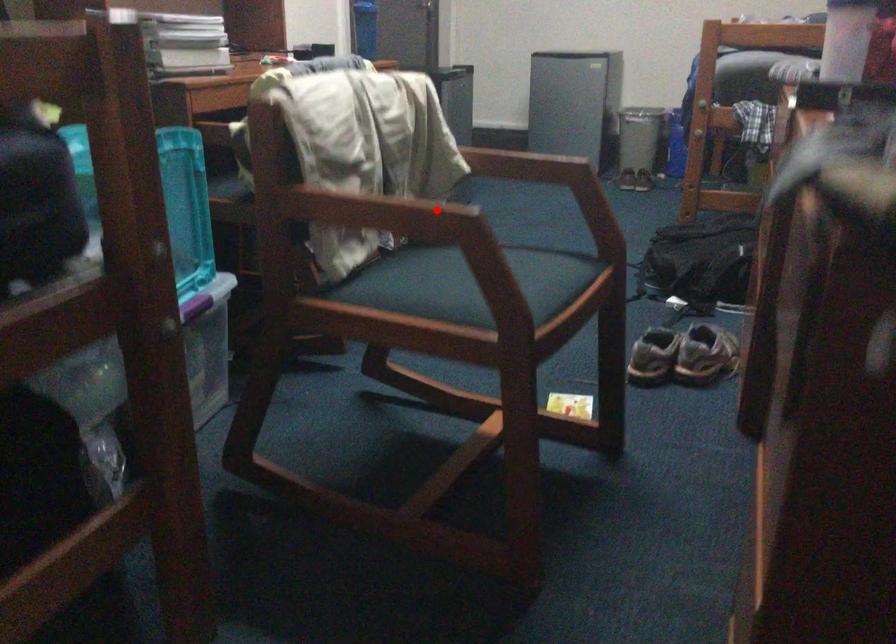
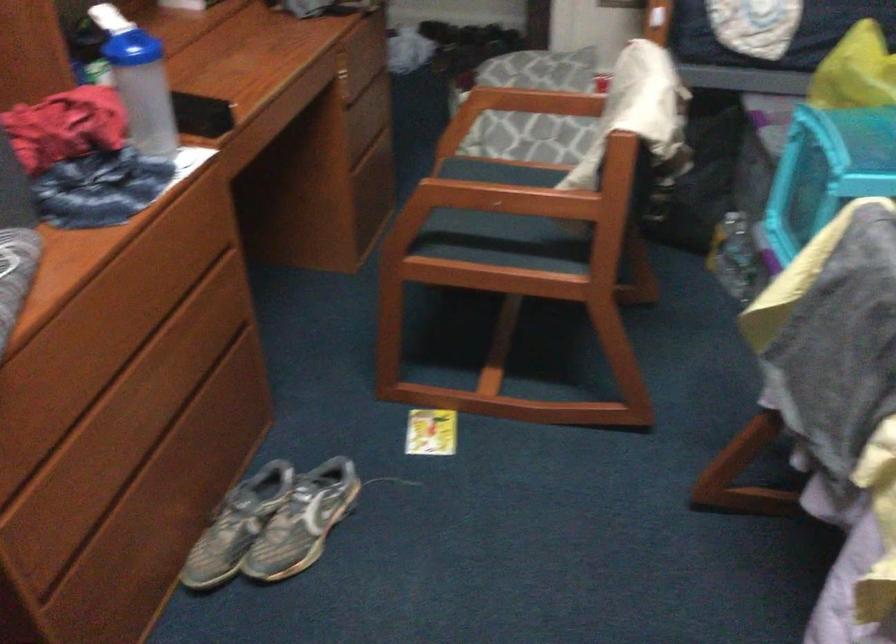
Question: I am providing you with two images of the same scene from different viewpoints. A red point is marked on the first image. Can you still see the location of the red point in image 2?

Choices:
 (A) Yes
 (B) No

Answer: (B)